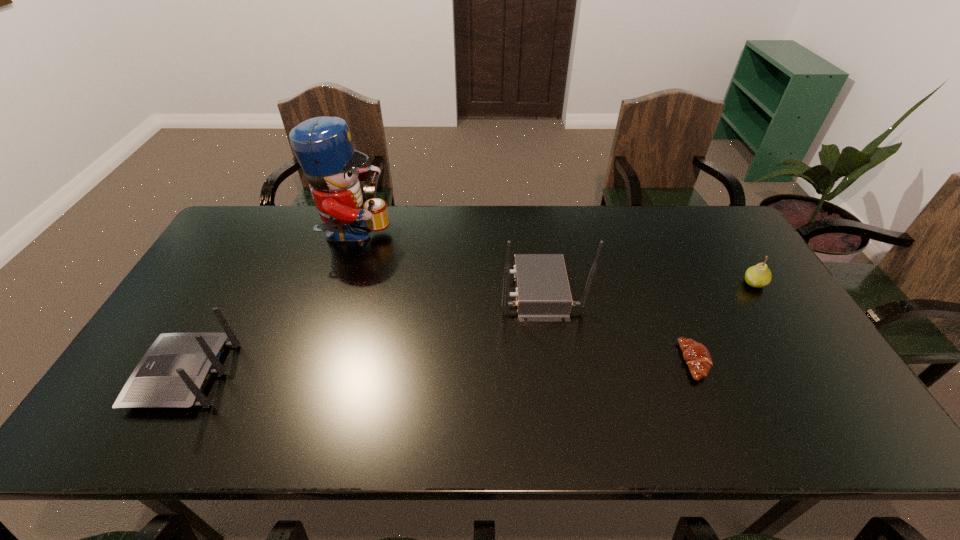
Locate an element on the screen. Image resolution: width=960 pixels, height=540 pixels. empty location between the taller router and the second object from right to left is located at coordinates (617, 326).

The width and height of the screenshot is (960, 540). In order to click on vacant space that is in between the shortest object and the right router in this screenshot , I will do `click(617, 326)`.

At what (x,y) coordinates should I click in order to perform the action: click on empty location between the crescent roll and the third object from right to left. Please return your answer as a coordinate pair (x, y). Looking at the image, I should click on (617, 326).

The height and width of the screenshot is (540, 960). In order to click on free space between the nearer router and the tallest object in this screenshot , I will do `click(270, 306)`.

The height and width of the screenshot is (540, 960). I want to click on free space between the second shortest object and the left router, so click(469, 329).

What are the coordinates of `unoccupied area between the rightmost object and the shortest object` in the screenshot? It's located at (725, 322).

I want to click on empty space that is in between the fourth object from right to left and the nearer router, so click(270, 306).

Identify the location of free space between the nearer router and the second object from left to right. (270, 306).

Locate an element on the screen. This screenshot has height=540, width=960. object that is the fourth closest to the second shortest object is located at coordinates (173, 373).

Locate which object ranks fourth in proximity to the pear. Please provide its 2D coordinates. Your answer should be formatted as a tuple, i.e. [(x, y)], where the tuple contains the x and y coordinates of a point satisfying the conditions above.

[(173, 373)]